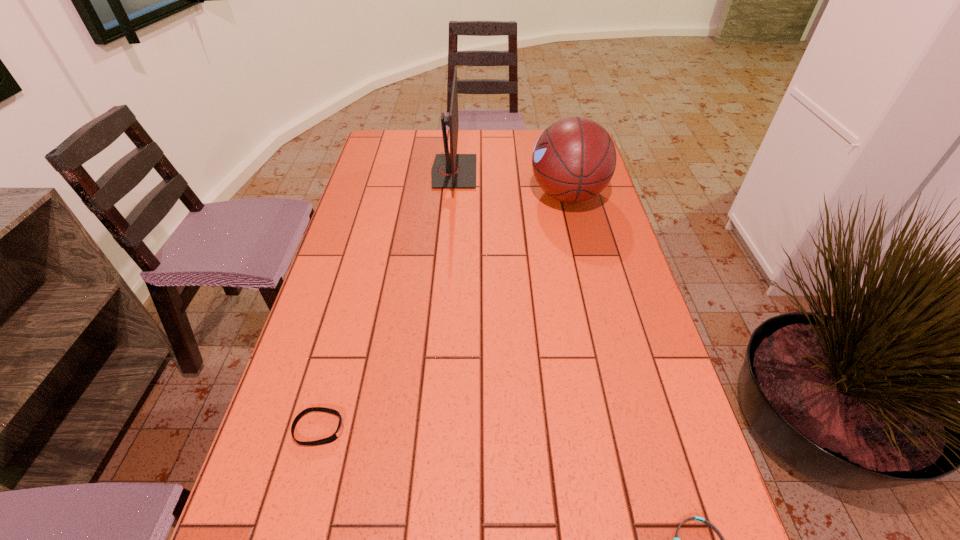
Identify the location of vacant space at the far edge of the desktop. (477, 145).

Where is `blank space at the left edge`? blank space at the left edge is located at coordinates (368, 273).

Locate an element on the screen. vacant space at the right edge is located at coordinates (680, 411).

This screenshot has width=960, height=540. In the image, there is a desktop. Find the location of `vacant space at the far left corner`. vacant space at the far left corner is located at coordinates (392, 139).

At what (x,y) coordinates should I click in order to perform the action: click on free spot between the leftmost object and the basketball. Please return your answer as a coordinate pair (x, y). The height and width of the screenshot is (540, 960). Looking at the image, I should click on (444, 312).

Image resolution: width=960 pixels, height=540 pixels. Identify the location of vacant area that lies between the leftmost object and the monitor. (387, 300).

Locate an element on the screen. This screenshot has width=960, height=540. blank region between the leftmost object and the basketball is located at coordinates (444, 312).

The image size is (960, 540). I want to click on object that stands as the closest to the shorter wristband, so click(x=333, y=437).

This screenshot has width=960, height=540. Find the location of `object identified as the closest to the third shortest object`. object identified as the closest to the third shortest object is located at coordinates 450,170.

At what (x,y) coordinates should I click in order to perform the action: click on free point that satisfies the following two spatial constraints: 1. on the back side of the basketball; 2. on the screen side of the third object from right to left. Please return your answer as a coordinate pair (x, y). Looking at the image, I should click on (563, 172).